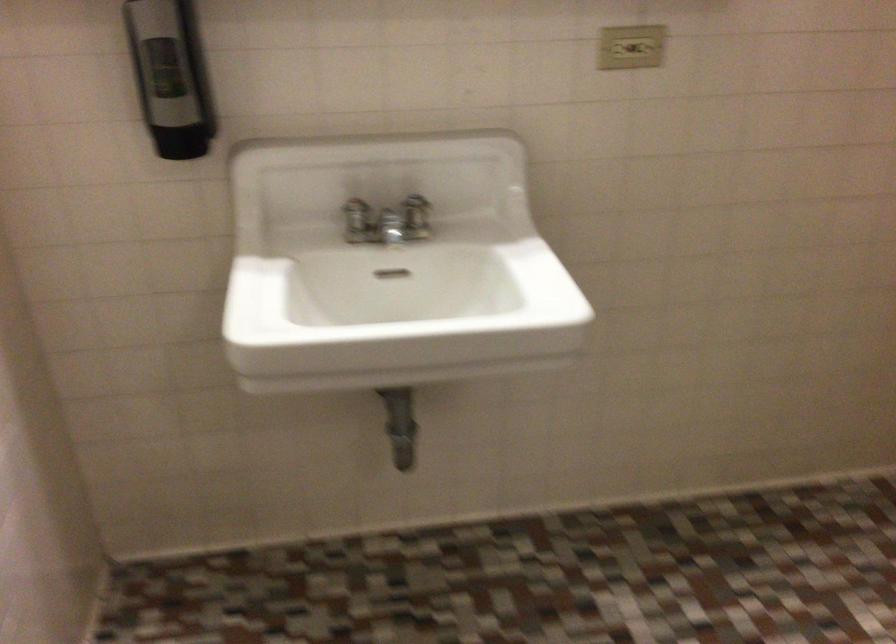
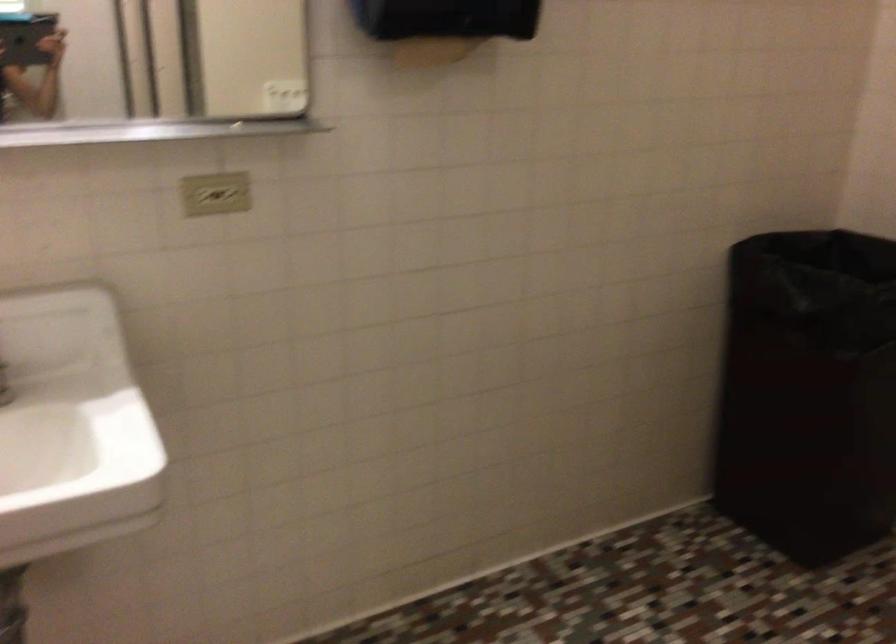
Question: The camera is either moving clockwise (left) or counter-clockwise (right) around the object. The first image is from the beginning of the video and the second image is from the end. Is the camera moving left or right when shooting the video?

Choices:
 (A) Left
 (B) Right

Answer: (A)